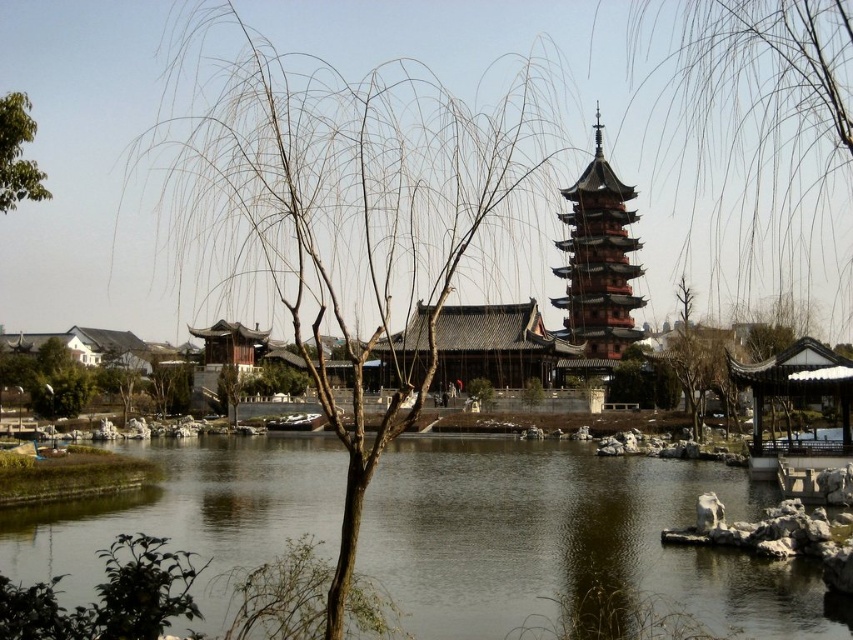
Does bare wood tree at center have a greater height compared to green leafy tree at upper left?

Indeed, bare wood tree at center has a greater height compared to green leafy tree at upper left.

The width and height of the screenshot is (853, 640). What do you see at coordinates (351, 212) in the screenshot?
I see `bare wood tree at center` at bounding box center [351, 212].

The height and width of the screenshot is (640, 853). What are the coordinates of `bare wood tree at center` in the screenshot? It's located at (x=351, y=212).

Is bare wood tree at center above bare branches at upper center?

Actually, bare wood tree at center is below bare branches at upper center.

Between bare wood tree at center and bare branches at upper center, which one is positioned higher?

bare branches at upper center is above.

Which is behind, point (277, 224) or point (769, 54)?

The point (769, 54) is more distant.

Find the location of a particular element. bare wood tree at center is located at coordinates (351, 212).

Identify the location of bare branches at upper center. (757, 128).

Between point (737, 35) and point (612, 227), which one is positioned behind?

The point (612, 227) is more distant.

What do you see at coordinates (757, 128) in the screenshot?
I see `bare branches at upper center` at bounding box center [757, 128].

Locate an element on the screen. bare branches at upper center is located at coordinates (757, 128).